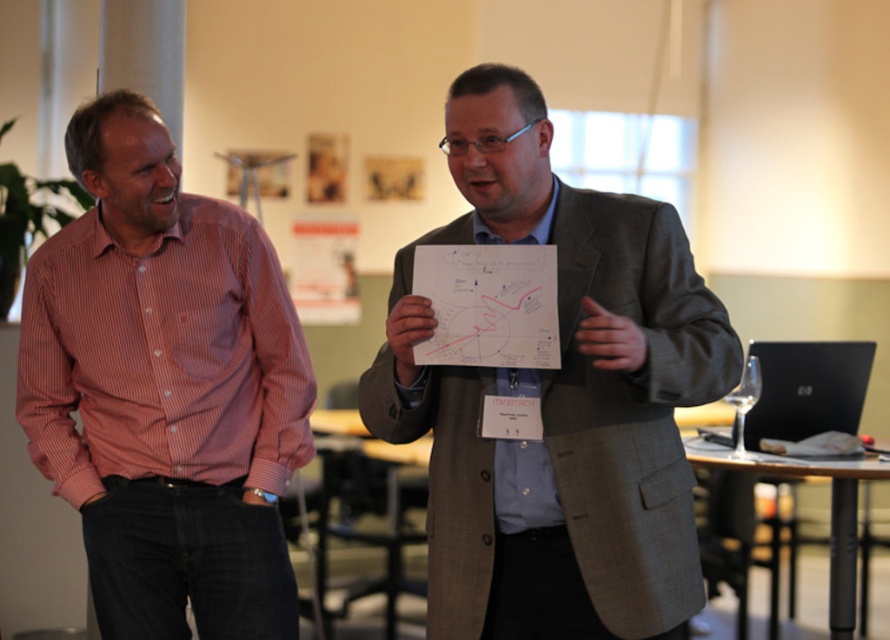
Measure the distance from matte pink shirt at left to pink striped shirt at left.

A distance of 33.32 inches exists between matte pink shirt at left and pink striped shirt at left.

Is matte pink shirt at left smaller than pink striped shirt at left?

Incorrect, matte pink shirt at left is not smaller in size than pink striped shirt at left.

Describe the element at coordinates (557, 400) in the screenshot. I see `matte pink shirt at left` at that location.

Where is `matte pink shirt at left`? The height and width of the screenshot is (640, 890). matte pink shirt at left is located at coordinates (557, 400).